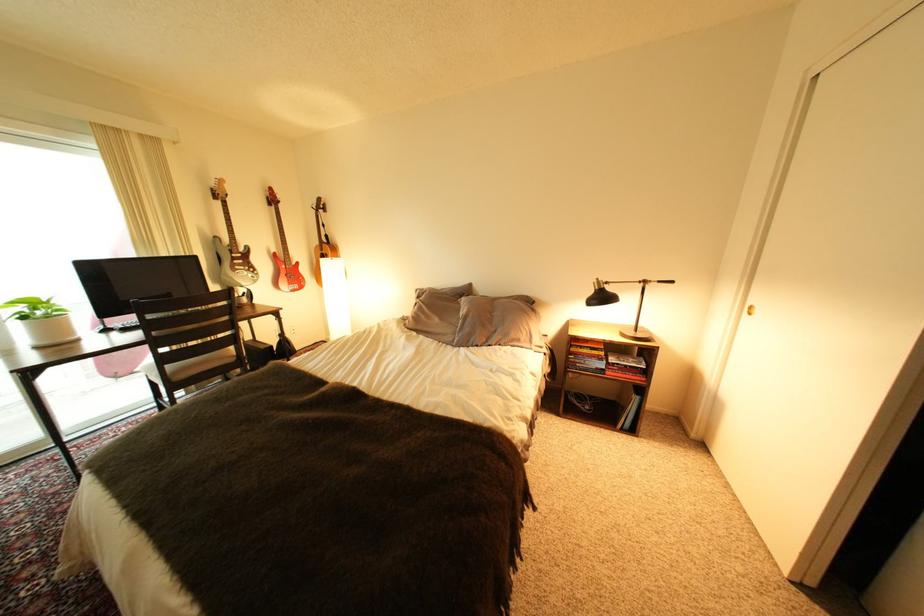
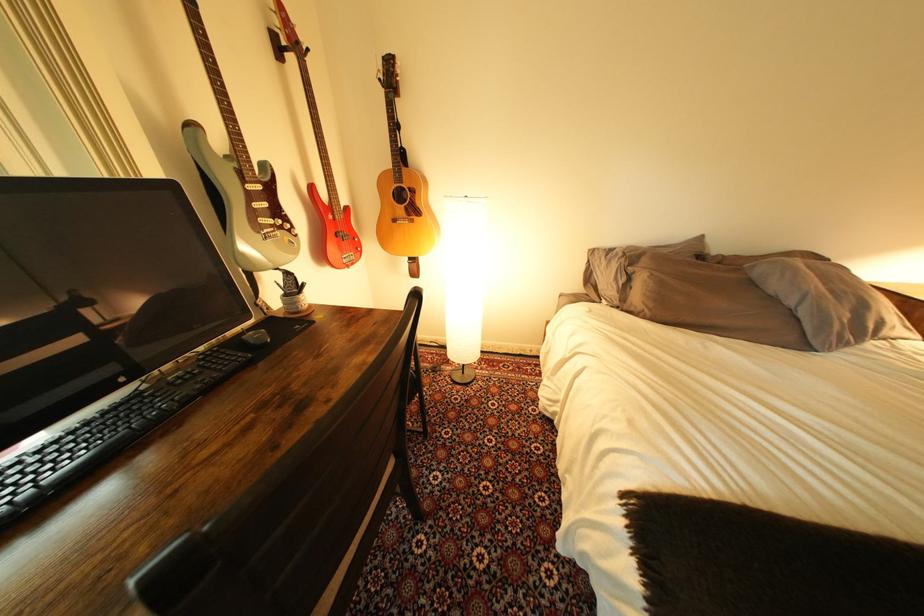
In the second image, find the point that corresponds to (x=473, y=302) in the first image.

(767, 268)